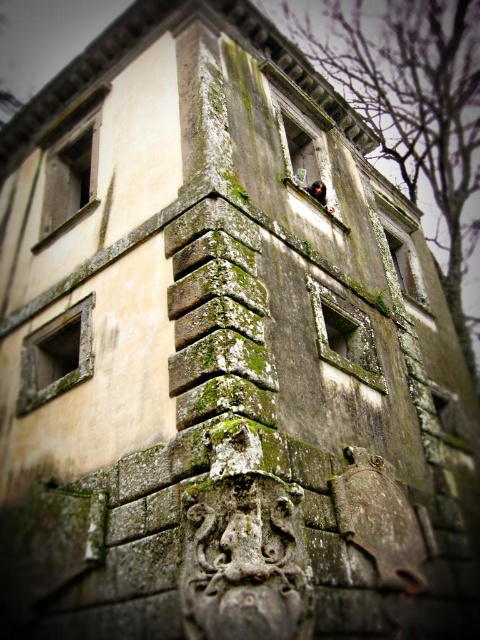
Question: Can you confirm if green mossy stone window at lower left is wider than matte stone window at upper left?

Choices:
 (A) no
 (B) yes

Answer: (A)

Question: Among these points, which one is farthest from the camera?

Choices:
 (A) (315, 280)
 (B) (67, 186)
 (C) (36, 352)
 (D) (277, 116)

Answer: (B)

Question: Which object appears farthest from the camera in this image?

Choices:
 (A) green mossy stone window at lower left
 (B) green mossy stone window at center
 (C) green mossy stone window at upper center
 (D) matte stone window at upper left

Answer: (D)

Question: Which point appears closest to the camera in this image?

Choices:
 (A) (24, 340)
 (B) (330, 348)
 (C) (49, 195)

Answer: (B)

Question: Is green mossy stone window at lower left positioned in front of green mossy stone window at upper center?

Choices:
 (A) yes
 (B) no

Answer: (A)

Question: Does green mossy stone window at upper center appear under matte stone window at upper left?

Choices:
 (A) yes
 (B) no

Answer: (B)